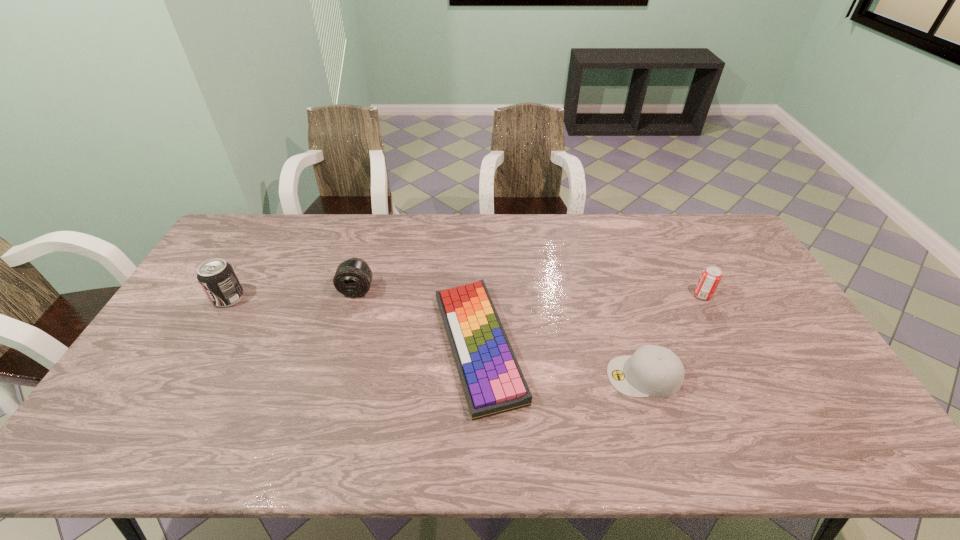
Identify the location of the left soda can. (217, 278).

You are a GUI agent. You are given a task and a screenshot of the screen. Output one action in this format:
    pyautogui.click(x=<x>, y=<y>)
    Task: Click on the leftmost object
    
    Given the screenshot: What is the action you would take?
    tap(217, 278)

Find the location of a particular element. The height and width of the screenshot is (540, 960). telephoto lens is located at coordinates (353, 277).

This screenshot has width=960, height=540. Identify the location of the rightmost object. (711, 275).

Where is `the shorter soda can`? This screenshot has width=960, height=540. the shorter soda can is located at coordinates (711, 275).

Identify the location of the fourth tallest object. (655, 371).

Where is `cap`? This screenshot has width=960, height=540. cap is located at coordinates (655, 371).

I want to click on computer keyboard, so click(x=493, y=383).

Where is `the shortest object`? The image size is (960, 540). the shortest object is located at coordinates (493, 383).

Where is `blank area located on the right of the left soda can`? This screenshot has width=960, height=540. blank area located on the right of the left soda can is located at coordinates (332, 298).